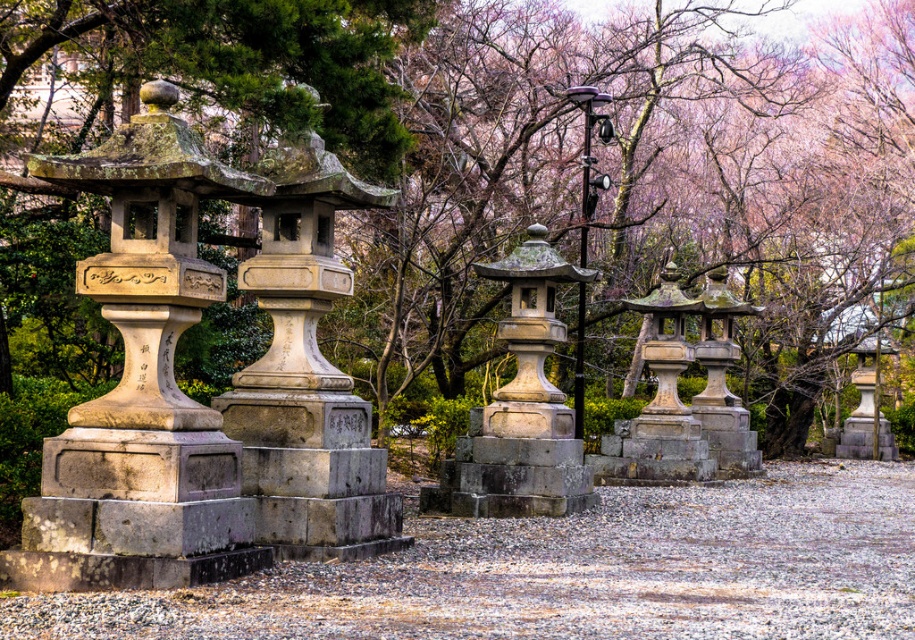
You are standing at the entrance of the garden and want to place a small decorative stone at the exact center of the gray gravel at center. According to the coordinates provided, where should you place it?

The exact center of the gray gravel at center is located at coordinates point (572, 572).

From the picture: You are a gardener who needs to plant a new flower bed. You see the gray gravel at center and the polished metal lamp post at center. Which object is located below the other?

The gray gravel at center is positioned under the polished metal lamp post at center, so the gray gravel is below the lamp post.

You are a gardener planning to place a new decorative item in the garden. You have a small potted plant that needs to be placed on the ground. Considering the green textured stone lantern at center and the gray gravel at center, where should you place the potted plant to ensure it sits directly on the ground?

The gray gravel at center is on the ground, so you should place the potted plant on the gray gravel at center to ensure it sits directly on the ground.